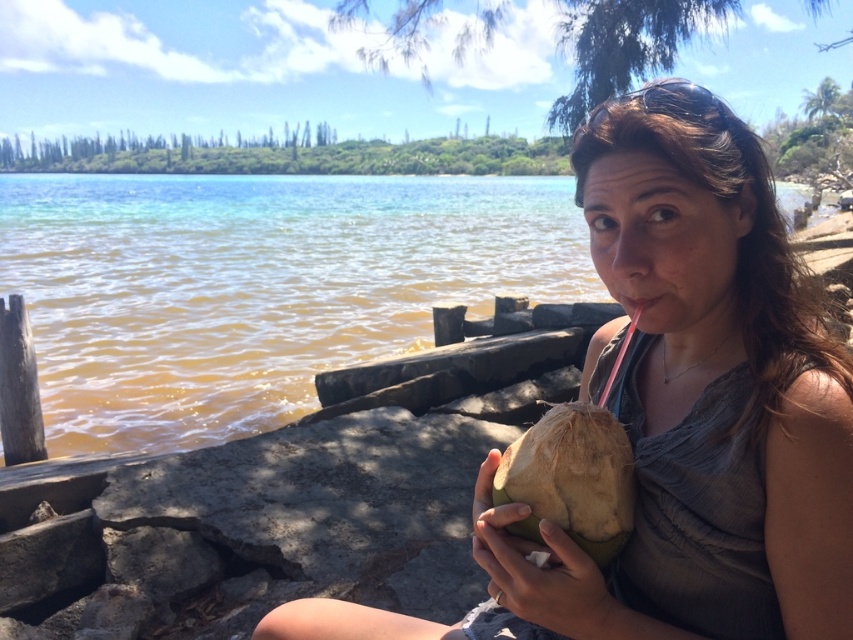
You are a beachgoer who wants to grab the coconut drink. Since both the brown rough coconut at lower center and the green rough coconut at lower center are in your view, which one is positioned higher?

The brown rough coconut at lower center is above the green rough coconut at lower center, so the brown one is higher.

You are a photographer planning to take a photo of the beach scene. You notice the green rough coconut at center and the clear water at center. Which object will appear shorter in your photo?

The green rough coconut at center will appear shorter in the photo because it has a lesser height compared to the clear water at center.

You are a beachgoer who wants to place your green rough coconut at center on the clear water at center to float it. Is the coconut positioned in a way that allows it to float on the water?

The green rough coconut at center is positioned under the clear water at center, so it is submerged and cannot float on the water surface. You need to move it to the water surface to allow floating.